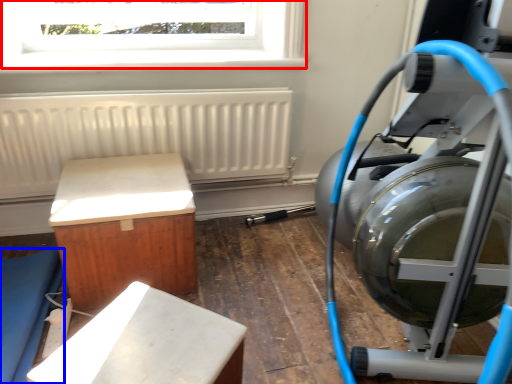
Question: Which object appears farthest to the camera in this image, window (highlighted by a red box) or furniture (highlighted by a blue box)?

Choices:
 (A) window
 (B) furniture

Answer: (A)